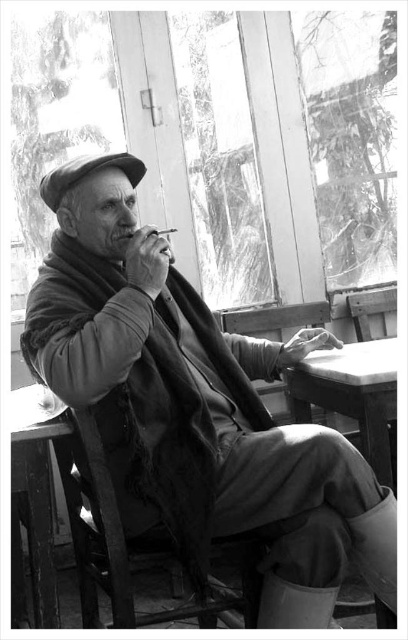
Does transparent glass window at upper center have a lesser height compared to smooth wooden table at lower left?

Incorrect, transparent glass window at upper center's height does not fall short of smooth wooden table at lower left's.

Does transparent glass window at upper center have a lesser width compared to smooth wooden table at lower left?

No, transparent glass window at upper center is not thinner than smooth wooden table at lower left.

The width and height of the screenshot is (408, 640). What do you see at coordinates (350, 138) in the screenshot?
I see `transparent glass window at upper center` at bounding box center [350, 138].

Identify the location of transparent glass window at upper center. The height and width of the screenshot is (640, 408). (350, 138).

Does smooth wooden table at lower center have a larger size compared to flat felt hat at center?

Yes, smooth wooden table at lower center is bigger than flat felt hat at center.

Does point (361, 344) come farther from viewer compared to point (110, 164)?

Yes, it is behind point (110, 164).

You are a GUI agent. You are given a task and a screenshot of the screen. Output one action in this format:
    pyautogui.click(x=<x>, y=<y>)
    Task: Click on the smooth wooden table at lower center
    This screenshot has width=408, height=640.
    Given the screenshot: What is the action you would take?
    pyautogui.click(x=352, y=394)

Can you confirm if smooth wooden table at lower left is thinner than smooth paper cigarette at center?

In fact, smooth wooden table at lower left might be wider than smooth paper cigarette at center.

Does smooth wooden table at lower left have a smaller size compared to smooth paper cigarette at center?

No.

Which is behind, point (31, 477) or point (172, 230)?

Point (172, 230)

Where is `smooth wooden table at lower left`? smooth wooden table at lower left is located at coordinates (33, 502).